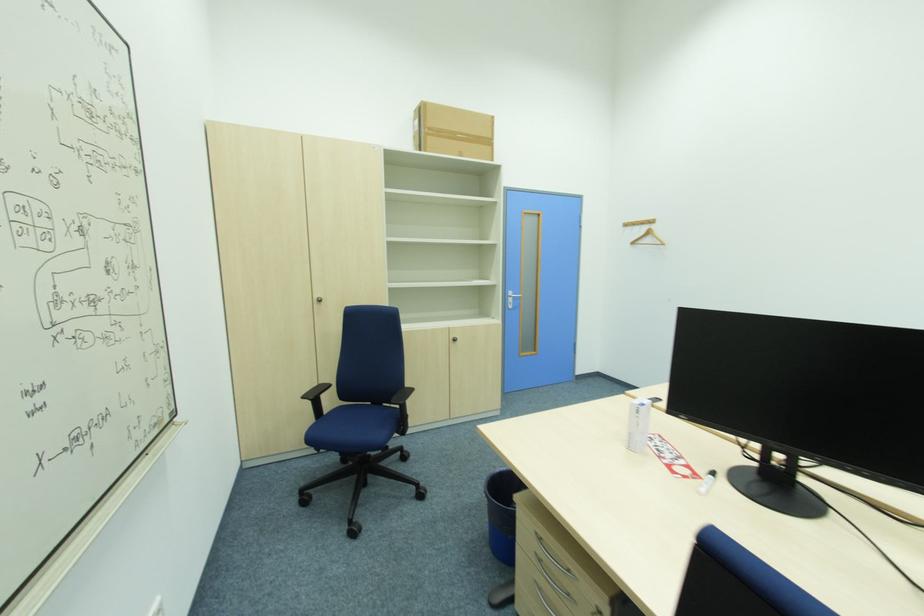
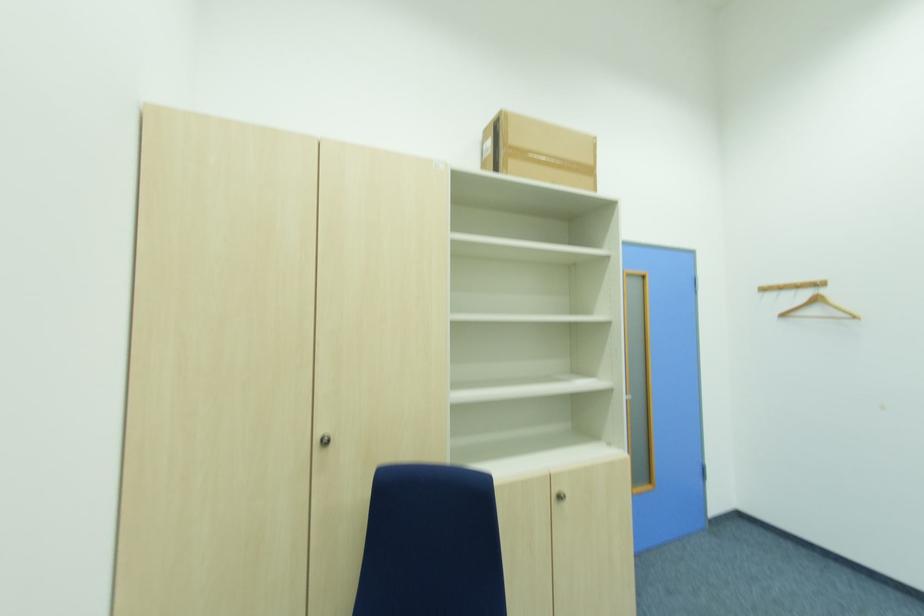
Where in the second image is the point corresponding to (x=650, y=229) from the first image?

(809, 296)